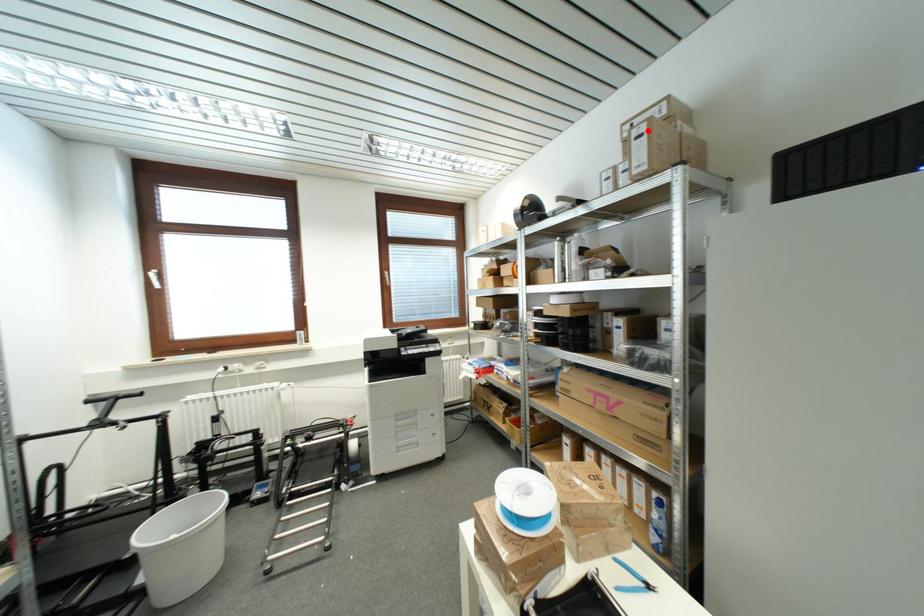
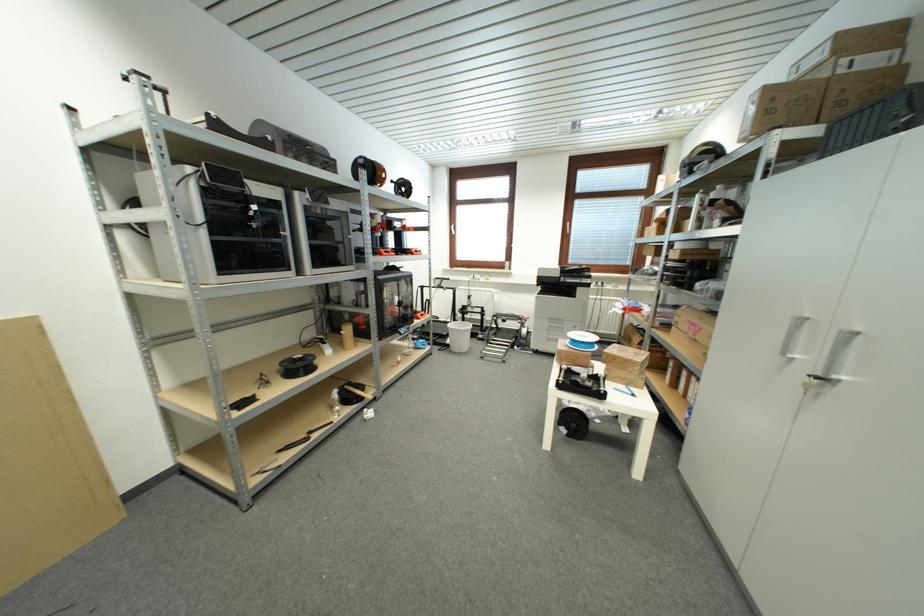
Where in the second image is the point corresponding to the highlighted location from the first image?

(761, 99)